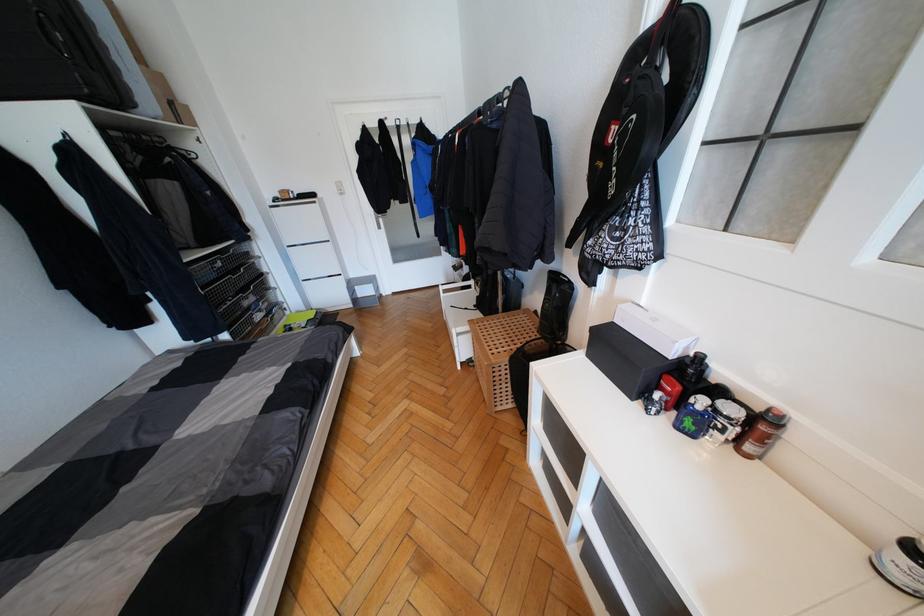
The width and height of the screenshot is (924, 616). Find the location of `blue perfume bottle`. blue perfume bottle is located at coordinates (694, 416).